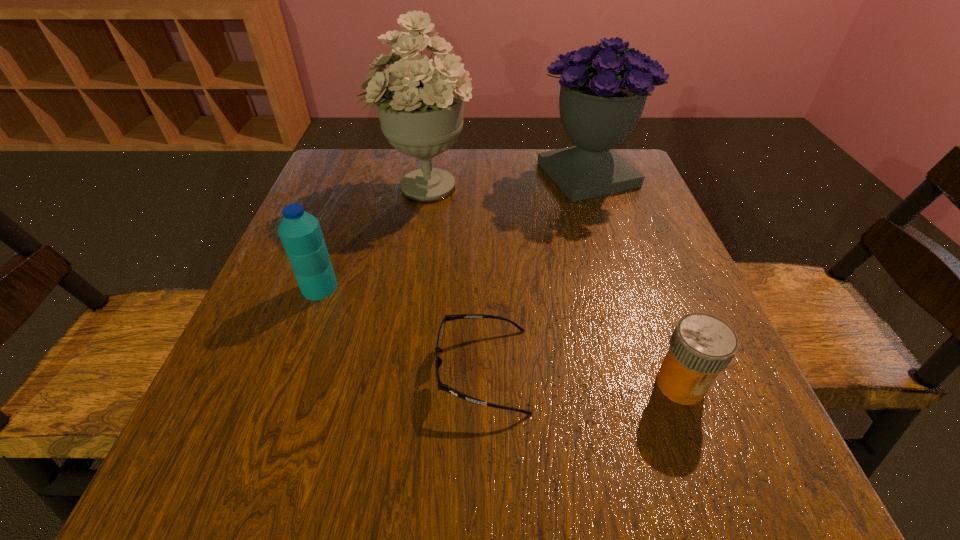
In order to click on the left bouquet in this screenshot , I will do `click(420, 102)`.

Where is `the right bouquet`? The image size is (960, 540). the right bouquet is located at coordinates (604, 88).

Where is `the shorter bouquet`? the shorter bouquet is located at coordinates (604, 88).

Locate an element on the screen. water bottle is located at coordinates (300, 232).

Identify the location of the leftmost object. Image resolution: width=960 pixels, height=540 pixels. (300, 232).

Locate an element on the screen. The width and height of the screenshot is (960, 540). medicine is located at coordinates (701, 346).

The height and width of the screenshot is (540, 960). In order to click on the shortest object in this screenshot , I will do `click(438, 361)`.

In order to click on vacant space located 0.370m on the right of the left bouquet in this screenshot , I will do `click(629, 185)`.

The image size is (960, 540). Identify the location of vacant space located on the front of the shorter bouquet. (602, 220).

The image size is (960, 540). Find the location of `blank space located 0.270m on the back of the water bottle`. blank space located 0.270m on the back of the water bottle is located at coordinates (353, 195).